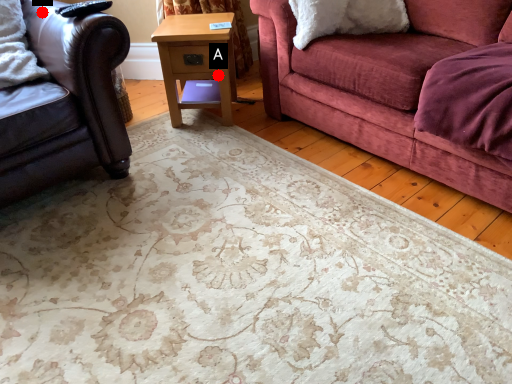
Question: Two points are circled on the image, labeled by A and B beside each circle. Which point is closer to the camera?

Choices:
 (A) A is closer
 (B) B is closer

Answer: (B)